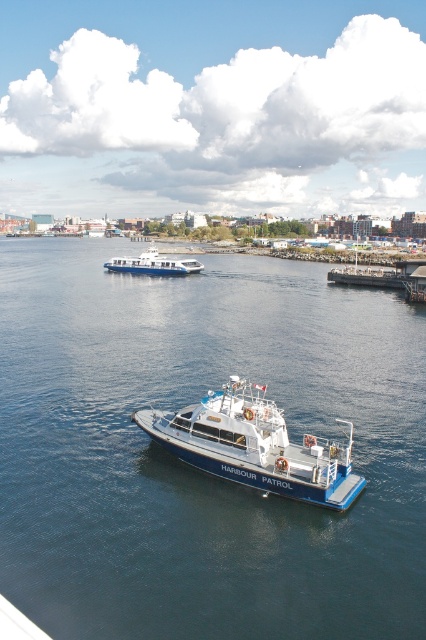
You are a tourist standing on the wooden dock at right and want to take a photo of the blue matte harbour patrol boat at center. Will the entire boat fit in your camera frame if your camera has a 1.5 meter wide field of view?

The blue matte harbour patrol boat at center is shorter than the wooden dock at right. Since the dock is longer than the boat, and the boat is at center, the boat should fit within the 1.5 meter field of view as it is shorter than the dock which is longer than 1.5 meters. However, without exact measurements of the boat itself, we can infer based on the comparison that it should fit.

You are a tourist standing on the wooden dock at right and want to take a photo of the blue matte harbour patrol boat at center. Since the boat is smaller in the frame, how should you adjust your position to make it appear larger in your photo?

To make the blue matte harbour patrol boat at center appear larger in your photo, you should move closer to it while staying on the wooden dock at right. Since the boat is smaller compared to the dock, reducing the distance between you and the boat will magnify its size in the frame.